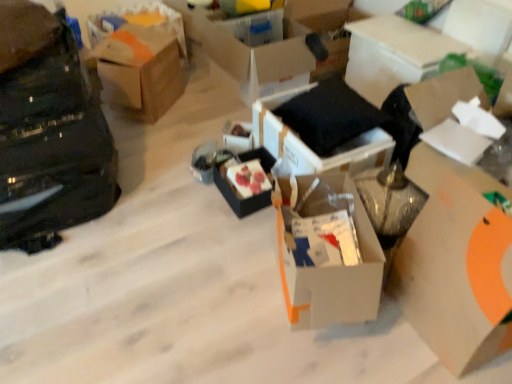
Identify the location of vacant space that's between black matte bag at left and white cardboard box at center, arranged as the 2th storage box when viewed from the back. The height and width of the screenshot is (384, 512). (154, 164).